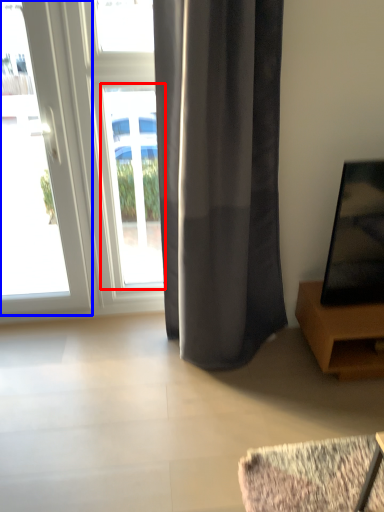
Question: Which object is further to the camera taking this photo, window (highlighted by a red box) or door (highlighted by a blue box)?

Choices:
 (A) window
 (B) door

Answer: (A)